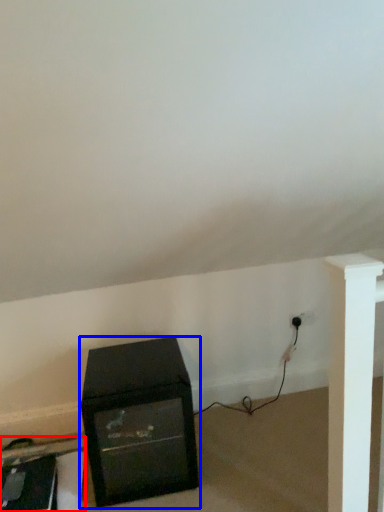
Question: Which of the following is the farthest to the observer, furniture (highlighted by a red box) or furniture (highlighted by a blue box)?

Choices:
 (A) furniture
 (B) furniture

Answer: (A)